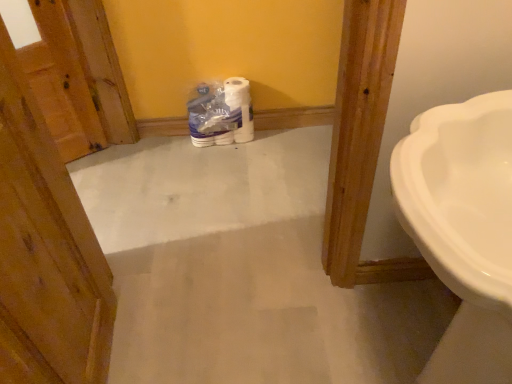
Image resolution: width=512 pixels, height=384 pixels. In order to click on vacant region below white glossy toilet paper at center (from a real-world perspective) in this screenshot , I will do `click(219, 142)`.